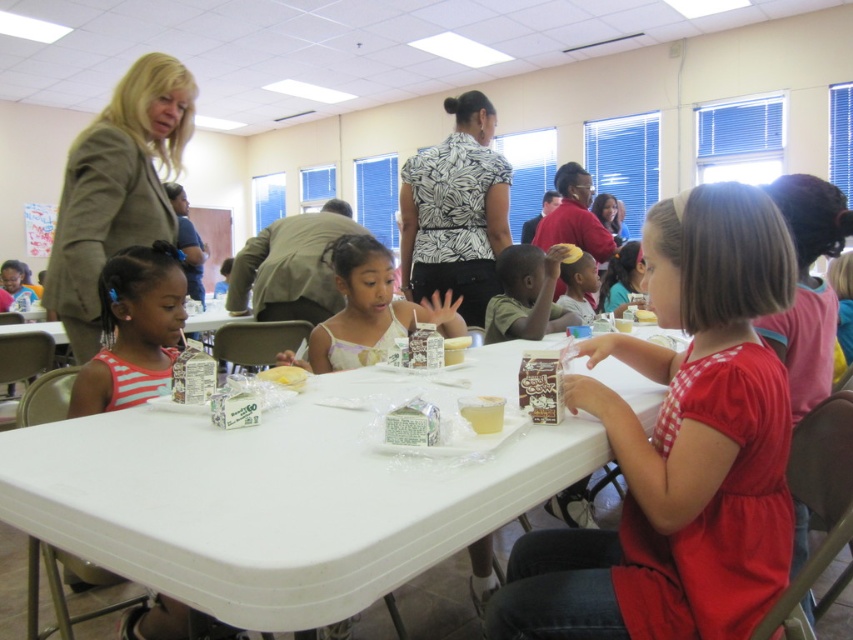
Question: Observing the image, what is the correct spatial positioning of striped fabric shirt at left in reference to white glossy cup at center?

Choices:
 (A) above
 (B) below

Answer: (B)

Question: Estimate the real-world distances between objects in this image. Which object is closer to the white leaf-patterned blouse at center?

Choices:
 (A) white plastic table at center
 (B) striped fabric shirt at left
 (C) yellow butter at center

Answer: (B)

Question: Which point is closer to the camera?

Choices:
 (A) (456, 339)
 (B) (479, 144)
 (C) (299, 380)

Answer: (C)

Question: Which of the following is the farthest from the observer?

Choices:
 (A) white glossy cup at center
 (B) striped fabric shirt at left
 (C) white paper cupcake at center
 (D) white leaf-patterned blouse at center

Answer: (D)

Question: Does matte red dress at center appear over white leaf-patterned blouse at center?

Choices:
 (A) yes
 (B) no

Answer: (B)

Question: Can you confirm if white plastic table at center is wider than white paper cupcake at center?

Choices:
 (A) no
 (B) yes

Answer: (B)